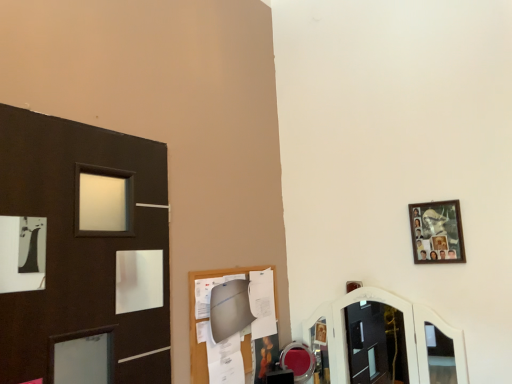
Question: Should I look upward or downward to see shiny red mirror at center?

Choices:
 (A) up
 (B) down

Answer: (B)

Question: Does shiny red mirror at center come behind wooden photo frame at upper right?

Choices:
 (A) no
 (B) yes

Answer: (B)

Question: From the image's perspective, is shiny red mirror at center located above wooden photo frame at upper right?

Choices:
 (A) yes
 (B) no

Answer: (B)

Question: Does shiny red mirror at center have a lesser width compared to wooden photo frame at upper right?

Choices:
 (A) no
 (B) yes

Answer: (A)

Question: Would you consider shiny red mirror at center to be distant from wooden photo frame at upper right?

Choices:
 (A) no
 (B) yes

Answer: (A)

Question: Is shiny red mirror at center outside wooden photo frame at upper right?

Choices:
 (A) no
 (B) yes

Answer: (B)

Question: From the image's perspective, is shiny red mirror at center under wooden photo frame at upper right?

Choices:
 (A) no
 (B) yes

Answer: (B)

Question: Is shiny red mirror at center a part of wooden photo frame at upper right?

Choices:
 (A) yes
 (B) no

Answer: (B)

Question: Can you confirm if wooden photo frame at upper right is shorter than shiny red mirror at center?

Choices:
 (A) no
 (B) yes

Answer: (A)

Question: From a real-world perspective, does wooden photo frame at upper right stand above shiny red mirror at center?

Choices:
 (A) no
 (B) yes

Answer: (B)

Question: Does wooden photo frame at upper right have a smaller size compared to shiny red mirror at center?

Choices:
 (A) yes
 (B) no

Answer: (A)

Question: Is the depth of wooden photo frame at upper right greater than that of shiny red mirror at center?

Choices:
 (A) no
 (B) yes

Answer: (A)

Question: Does wooden photo frame at upper right have a greater width compared to shiny red mirror at center?

Choices:
 (A) no
 (B) yes

Answer: (A)

Question: From the image's perspective, is wooden photo frame at upper right located above or below shiny red mirror at center?

Choices:
 (A) above
 (B) below

Answer: (A)